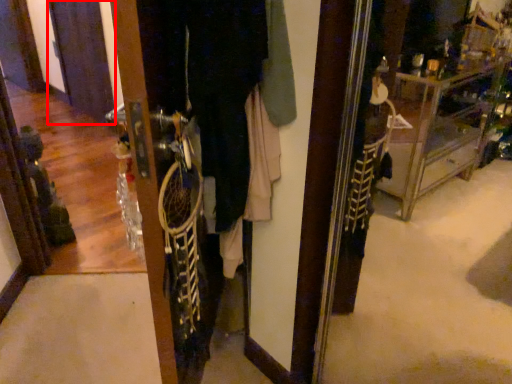
Question: From the image's perspective, what is the correct spatial relationship of screen door (annotated by the red box) in relation to closet?

Choices:
 (A) below
 (B) above

Answer: (B)